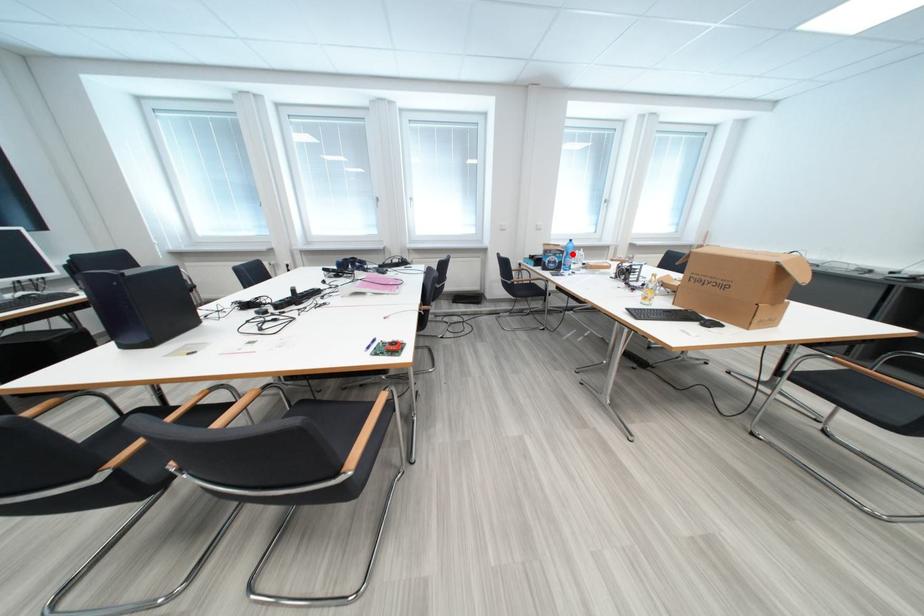
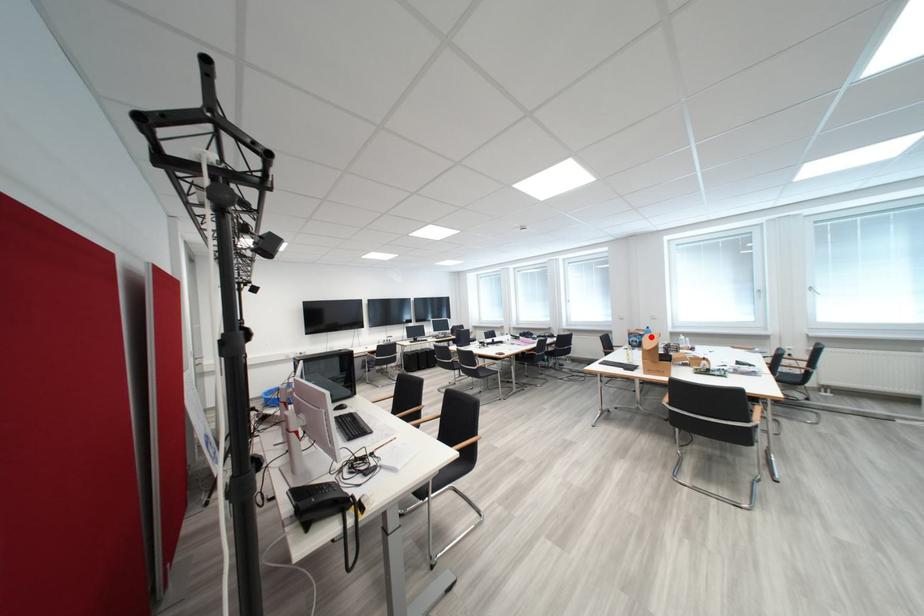
I am providing you with two images of the same scene from different viewpoints. A red point is marked on the first image and another point is marked on the second image. Is the marked point in image1 the same physical position as the marked point in image2?

Yes